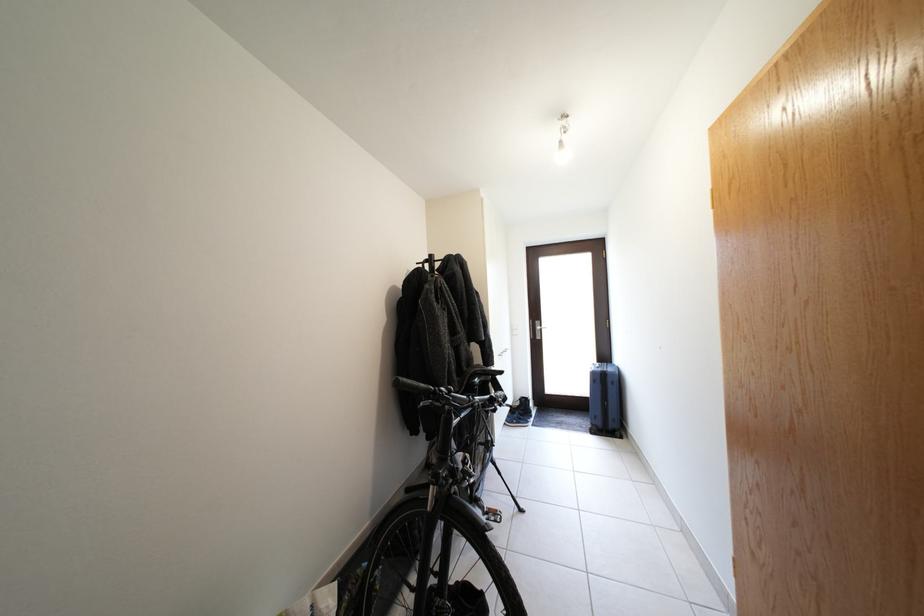
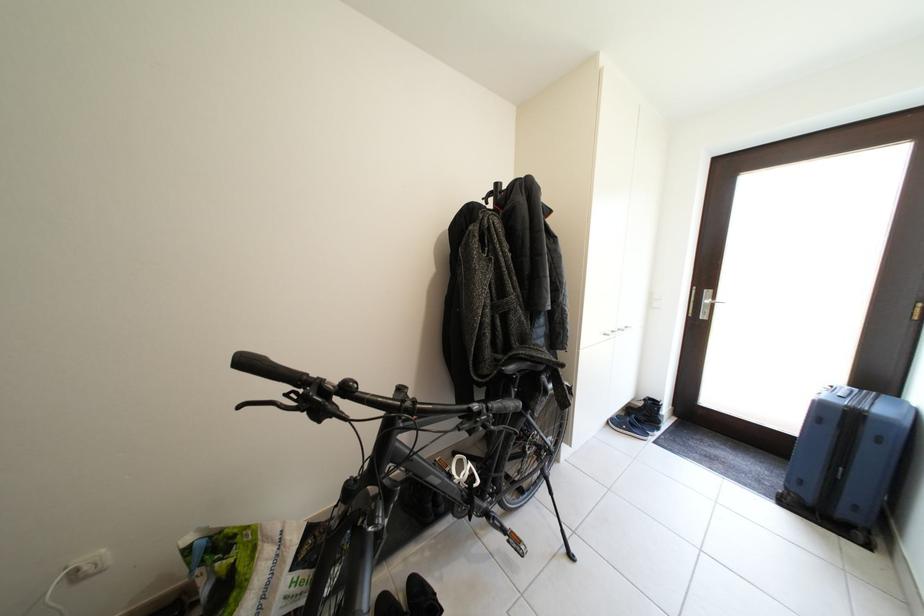
Question: How did the camera likely rotate?

Choices:
 (A) Left
 (B) Right
 (C) Up
 (D) Down

Answer: (A)